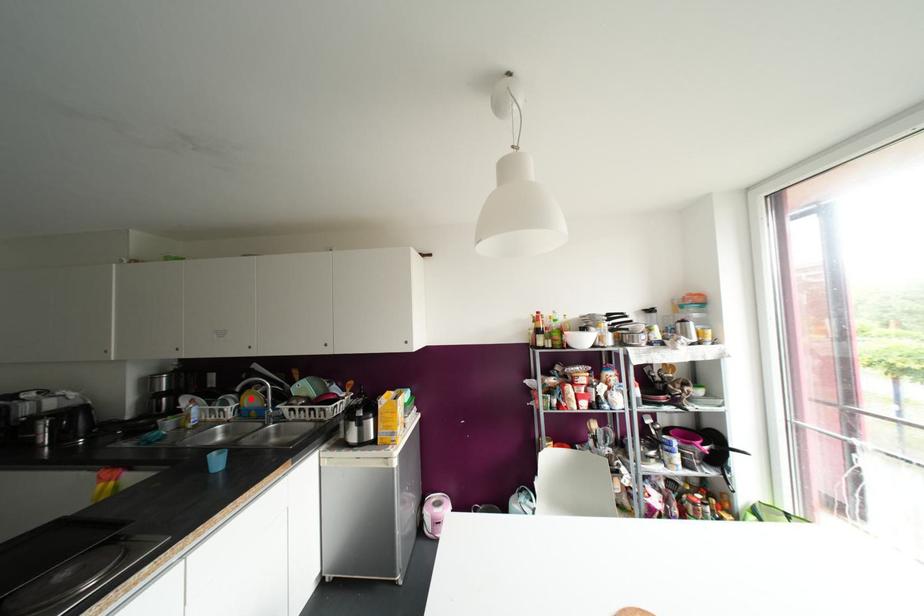
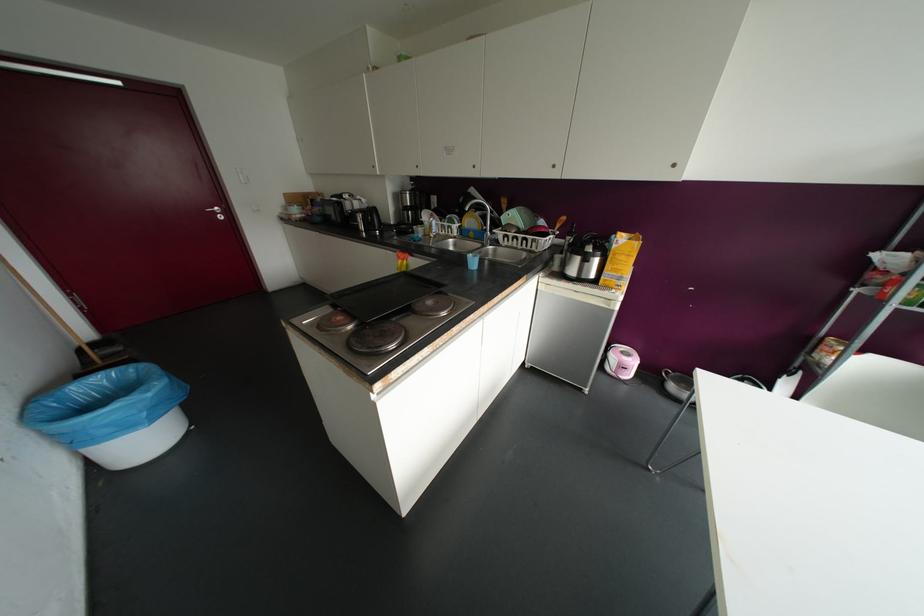
In the second image, find the point that corresponds to the highlighted location in the first image.

(469, 221)